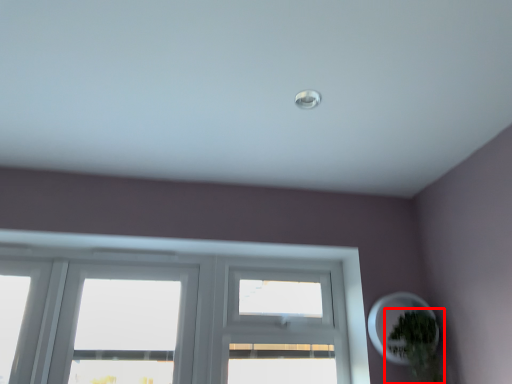
Question: From the image, what is the correct spatial relationship of houseplant (annotated by the red box) in relation to oval?

Choices:
 (A) left
 (B) right

Answer: (B)